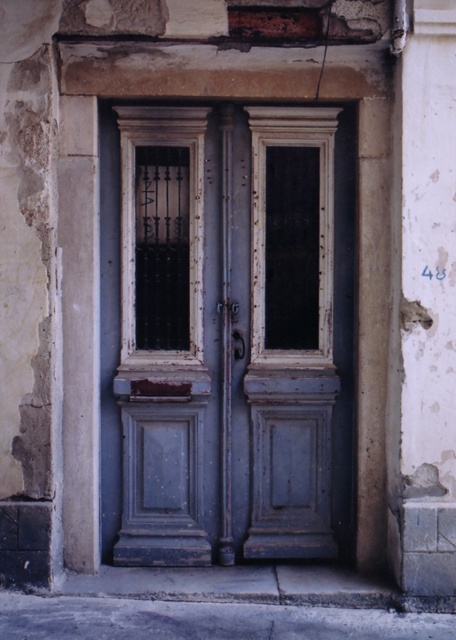
Which is in front, point (338, 156) or point (438, 108)?

Positioned in front is point (438, 108).

Does rusty wood door at center have a lesser width compared to white plaster pillar at right?

No.

Identify the location of rusty wood door at center. The image size is (456, 640). (228, 333).